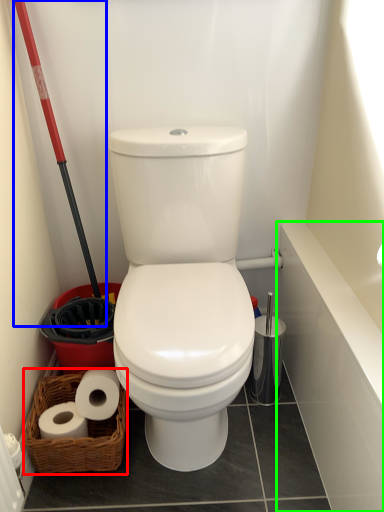
Question: Based on their relative distances, which object is farther from basket (highlighted by a red box)? Choose from shovel (highlighted by a blue box) and bath (highlighted by a green box).

Choices:
 (A) shovel
 (B) bath

Answer: (B)